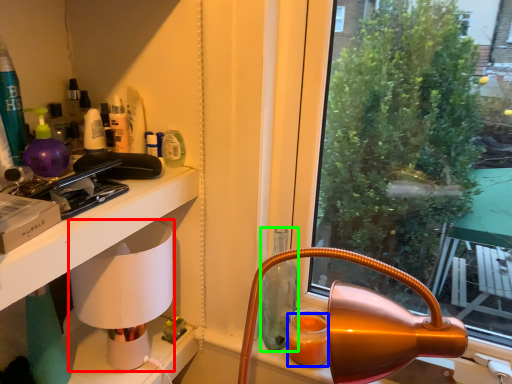
Question: Based on their relative distances, which object is nearer to oil lamp (highlighted by a red box)? Choose from orange juice (highlighted by a blue box) and bottle (highlighted by a green box).

Choices:
 (A) orange juice
 (B) bottle

Answer: (B)